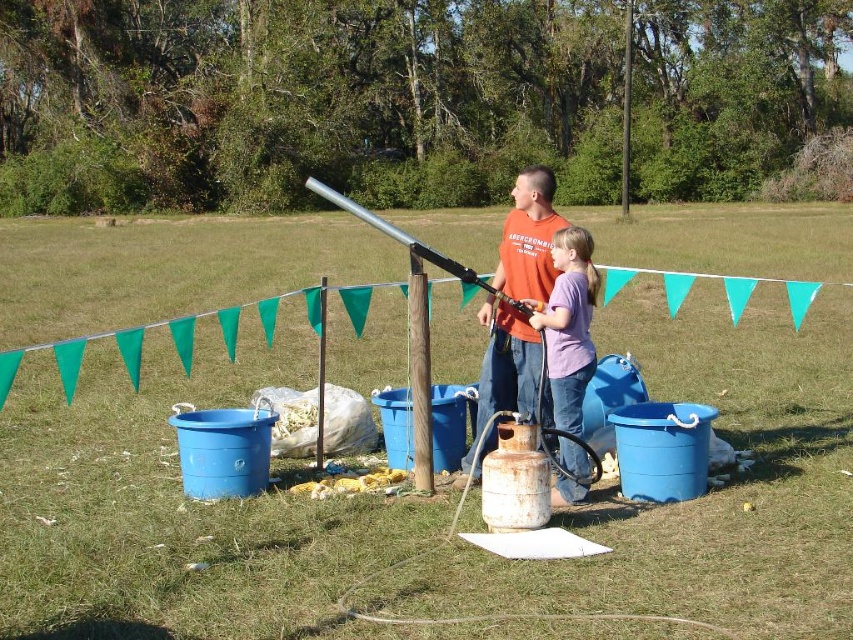
You are standing at the origin point in the grassy field and want to move towards the orange cotton shirt at center. Based on the coordinates provided in the description, in which general direction should you head?

The orange cotton shirt at center is located at point 0.372 on the x and 0.620 on the y. Since you are at the origin, you should move towards the northeast direction to reach it.

Where is the orange cotton shirt at center located in the image?

The orange cotton shirt at center is located at point 0.372 in the x coordinate and 0.620 in the y coordinate.

You are a photographer trying to capture a clear photo of the metallic cylindrical object on the wooden post. You notice two people, the orange cotton shirt at center and the purple cotton shirt at center, standing near it. Which person might be blocking the view more due to their height?

The orange cotton shirt at center is much taller than the purple cotton shirt at center, so they are more likely to be blocking the view of the metallic cylindrical object.